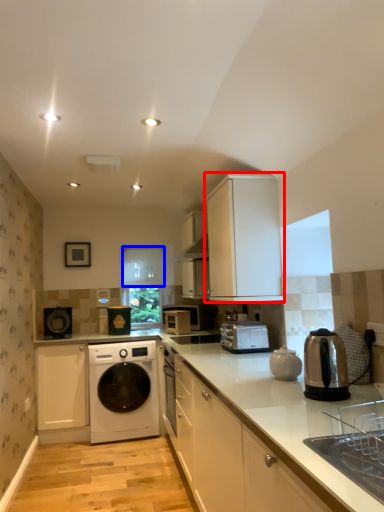
Question: Which of the following is the closest to the observer, cabinetry (highlighted by a red box) or window screen (highlighted by a blue box)?

Choices:
 (A) cabinetry
 (B) window screen

Answer: (A)